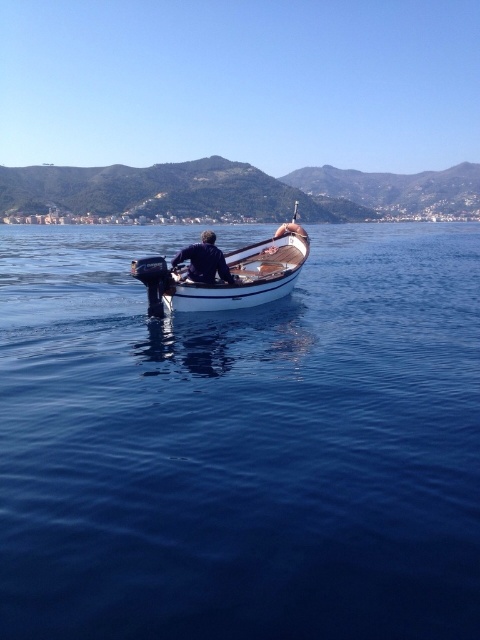
From the picture: What are the coordinates of the white polished wood boat at center?

The white polished wood boat at center is located at point (228, 275).

You are standing on the dock and want to throw a lifebuoy to the person in the boat. The lifebuoy can travel 60 feet. The coordinates of the person in the boat are point (288, 236). Can you reach them with the lifebuoy?

The distance between you and the person in the boat at point (288, 236) is 65.44 feet. Since the lifebuoy can only travel 60 feet, you cannot reach them.